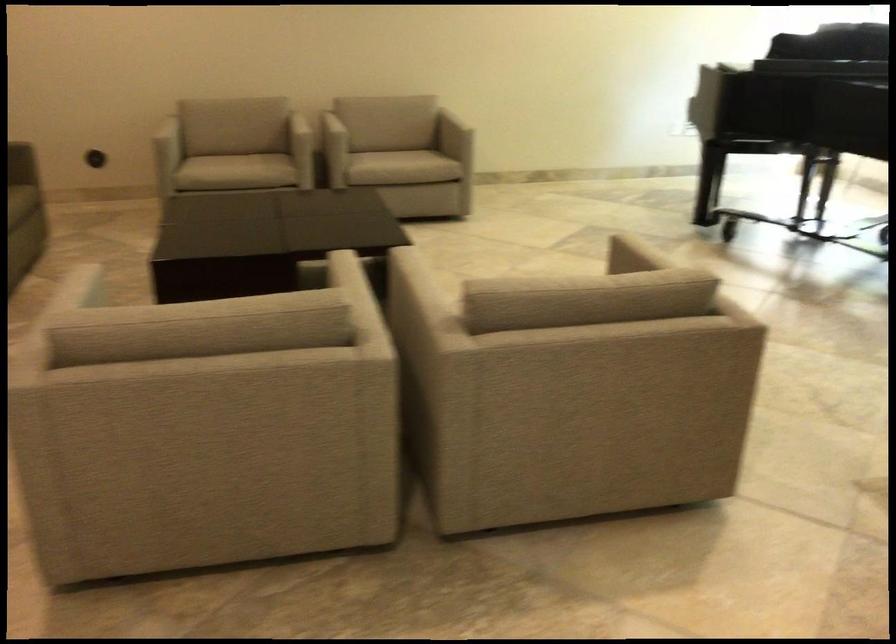
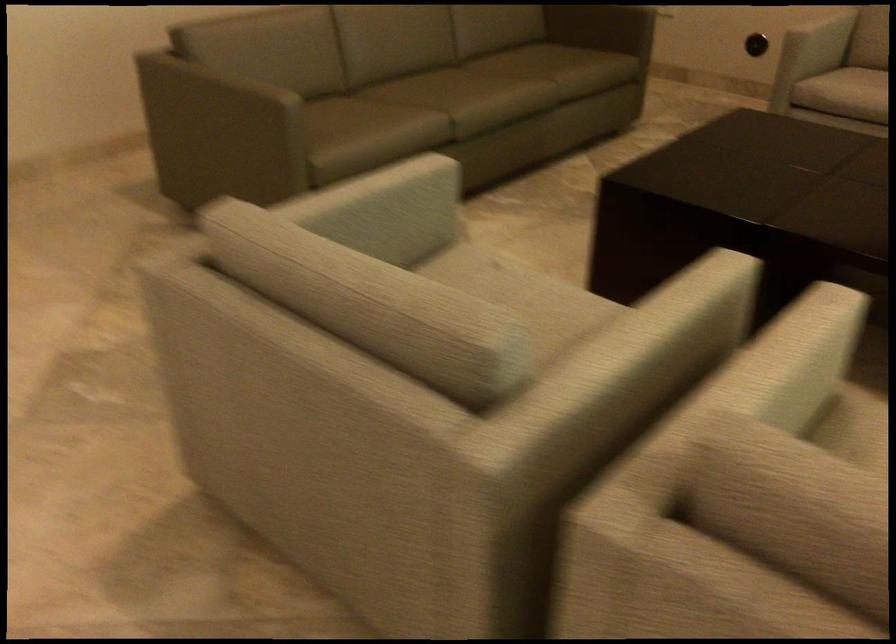
Locate, in the second image, the point that corresponds to the point at 74,310 in the first image.

(380, 210)